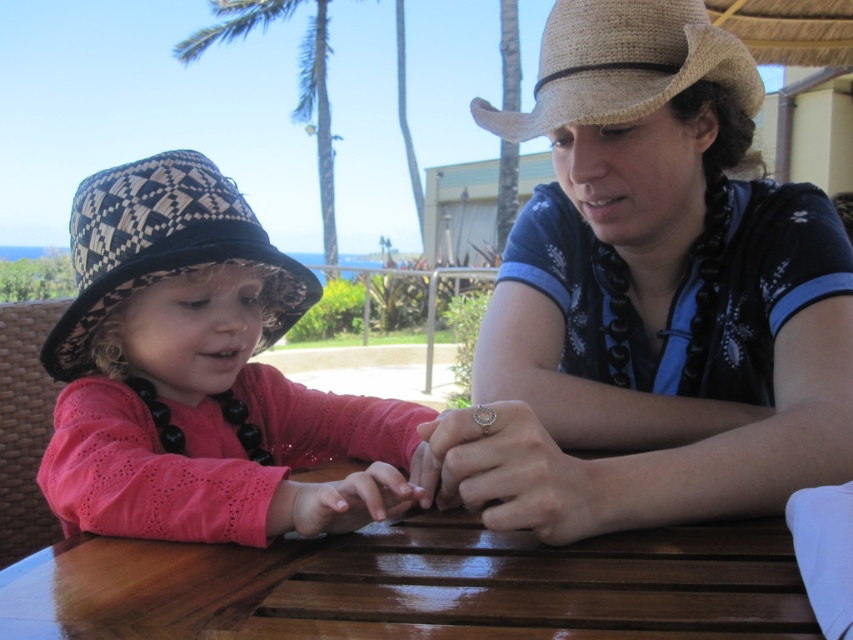
Question: Is matte black hat at left positioned at the back of woven straw cowboy hat at upper right?

Choices:
 (A) no
 (B) yes

Answer: (A)

Question: Does matte black hat at left appear over black and white woven straw hat at left?

Choices:
 (A) yes
 (B) no

Answer: (B)

Question: Which is farther from the matte black hat at left?

Choices:
 (A) rustic straw hat at upper right
 (B) black and white woven straw hat at left
 (C) shiny brown wood table at center
 (D) woven straw cowboy hat at upper right

Answer: (D)

Question: Can you confirm if shiny brown wood table at center is thinner than woven straw cowboy hat at upper right?

Choices:
 (A) yes
 (B) no

Answer: (B)

Question: Based on their relative distances, which object is nearer to the shiny brown wood table at center?

Choices:
 (A) rustic straw hat at upper right
 (B) black and white woven straw hat at left

Answer: (A)

Question: Which of the following is the closest to the observer?

Choices:
 (A) matte black hat at left
 (B) black and white woven straw hat at left

Answer: (A)